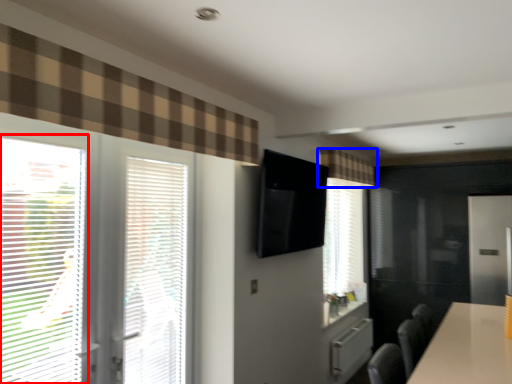
Question: Which of the following is the farthest to the observer, window (highlighted by a red box) or curtain (highlighted by a blue box)?

Choices:
 (A) window
 (B) curtain

Answer: (B)